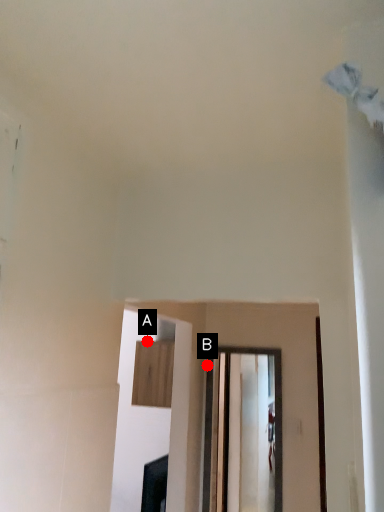
Question: Two points are circled on the image, labeled by A and B beside each circle. Among these points, which one is nearest to the camera?

Choices:
 (A) A is closer
 (B) B is closer

Answer: (B)